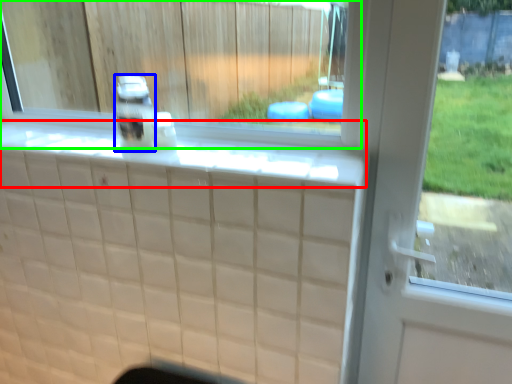
Question: Which object is positioned closest to ledge (highlighted by a red box)? Select from bottle (highlighted by a blue box) and window (highlighted by a green box).

Choices:
 (A) bottle
 (B) window

Answer: (A)